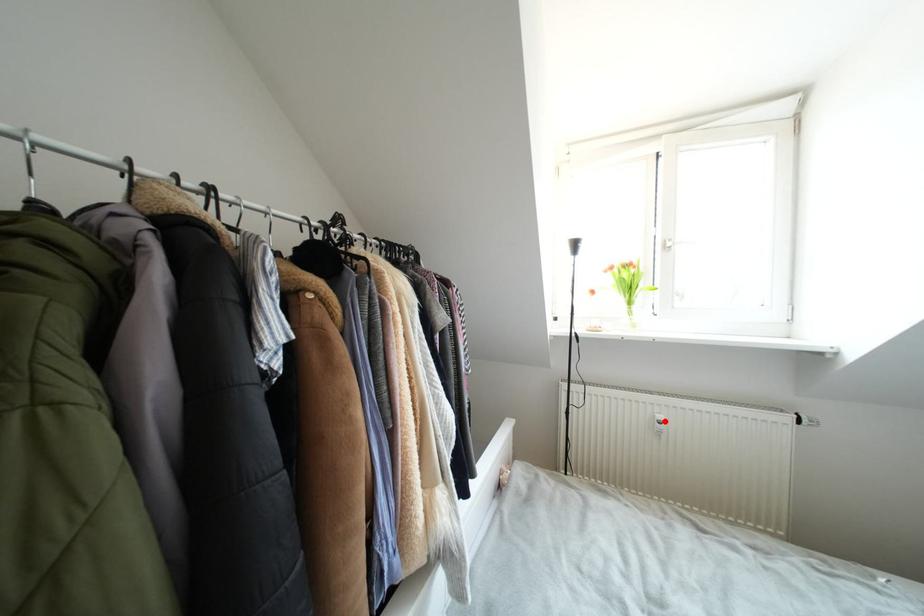
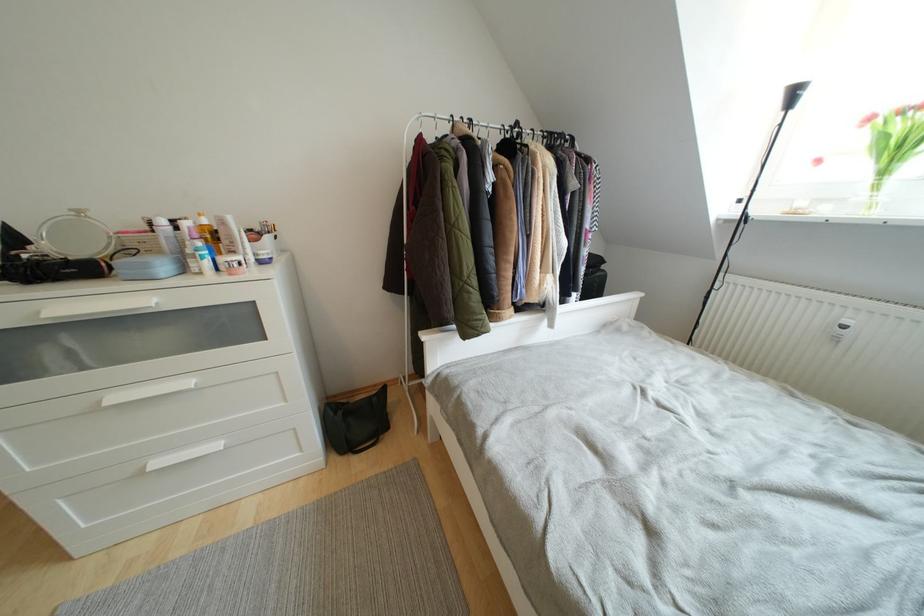
Where in the second image is the point corresponding to the highlighted location from the first image?

(853, 326)